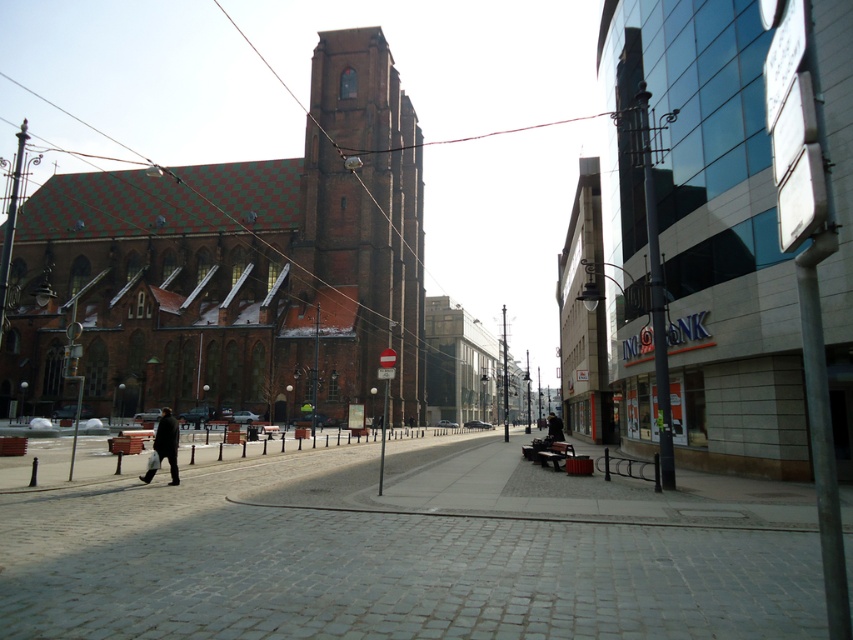
Question: Which of the following is the farthest from the observer?

Choices:
 (A) (126, 580)
 (B) (552, 438)

Answer: (B)

Question: Among these objects, which one is farthest from the camera?

Choices:
 (A) black leather jacket at center
 (B) brown brick church at left
 (C) gray cobblestone pavement at center
 (D) dark matte coat at lower left

Answer: (A)

Question: Is dark matte coat at lower left closer to camera compared to black leather jacket at center?

Choices:
 (A) no
 (B) yes

Answer: (B)

Question: Can you confirm if brown brick church at left is bigger than brown brick tower at center?

Choices:
 (A) yes
 (B) no

Answer: (A)

Question: Which point is farther to the camera?

Choices:
 (A) dark matte coat at lower left
 (B) brown brick church at left
 (C) brown brick tower at center

Answer: (C)

Question: Can you confirm if brown brick tower at center is positioned below black leather jacket at center?

Choices:
 (A) yes
 (B) no

Answer: (B)